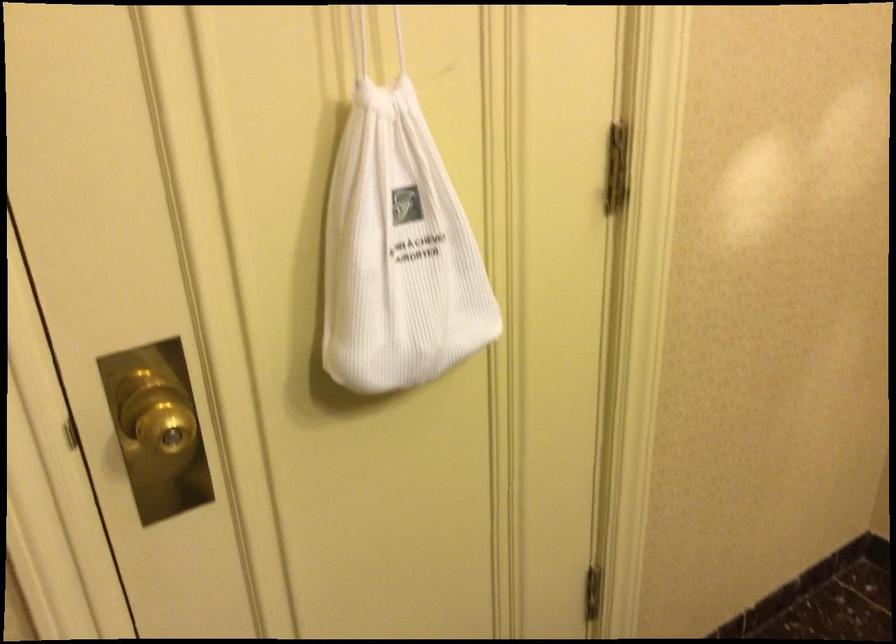
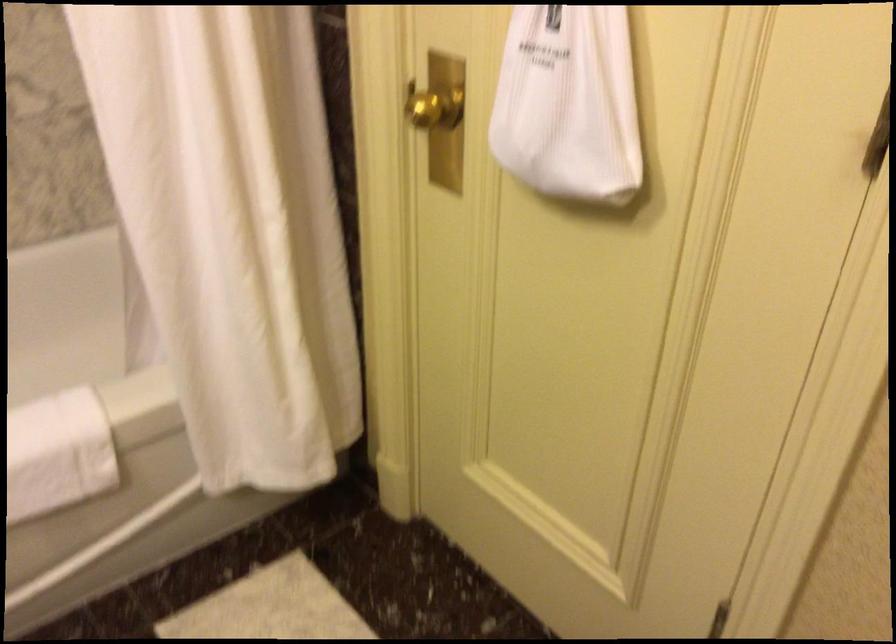
The images are taken continuously from a first-person perspective. In which direction is your viewpoint rotating?

The rotation direction of the camera is left-down.